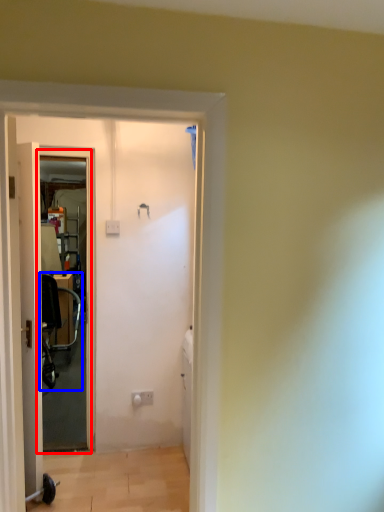
Question: Among these objects, which one is farthest to the camera, screen door (highlighted by a red box) or baby carriage (highlighted by a blue box)?

Choices:
 (A) screen door
 (B) baby carriage

Answer: (B)